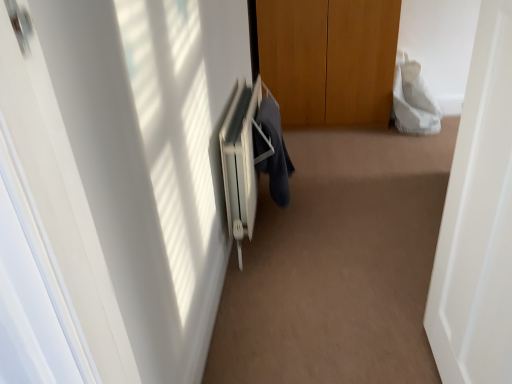
In order to face white textured towel at upper right, which is the 1th robe from back to front, should I rotate leftwards or rightwards?

Turn right approximately 21.077 degrees to face it.

This screenshot has height=384, width=512. What do you see at coordinates (413, 100) in the screenshot? I see `white textured towel at upper right, which is the 1th robe from back to front` at bounding box center [413, 100].

Locate an element on the screen. The image size is (512, 384). white matte door at right is located at coordinates pyautogui.click(x=478, y=220).

Is dark blue fabric at center, the 2th robe in the back-to-front sequence, surrounding white matte door at right?

No, dark blue fabric at center, the 2th robe in the back-to-front sequence, does not contain white matte door at right.

Is dark blue fabric at center, arranged as the 1th robe when viewed from the left, at the left side of white matte door at right?

Correct, you'll find dark blue fabric at center, arranged as the 1th robe when viewed from the left, to the left of white matte door at right.

Can you confirm if dark blue fabric at center, the 2th robe in the back-to-front sequence, is smaller than white matte door at right?

Yes.

Is dark blue fabric at center, which ranks as the 2th robe in top-to-bottom order, in contact with white matte door at right?

No.

Looking at this image, which of these two, dark blue fabric at center, the 2th robe in the back-to-front sequence, or white textured towel at upper right, acting as the second robe starting from the front, is thinner?

dark blue fabric at center, the 2th robe in the back-to-front sequence, is thinner.

From the picture: Considering the relative sizes of dark blue fabric at center, the first robe from the bottom, and white textured towel at upper right, which is the 1th robe from back to front, in the image provided, is dark blue fabric at center, the first robe from the bottom, smaller than white textured towel at upper right, which is the 1th robe from back to front,?

Indeed, dark blue fabric at center, the first robe from the bottom, has a smaller size compared to white textured towel at upper right, which is the 1th robe from back to front.

Can you confirm if dark blue fabric at center, the 2th robe in the back-to-front sequence, is taller than white textured towel at upper right, which is the 1th robe from back to front?

No, dark blue fabric at center, the 2th robe in the back-to-front sequence, is not taller than white textured towel at upper right, which is the 1th robe from back to front.

From the image's perspective, is dark blue fabric at center, which ranks as the 2th robe in top-to-bottom order, positioned above or below white textured towel at upper right, which is the 1th robe from back to front?

Clearly, from the image's perspective, dark blue fabric at center, which ranks as the 2th robe in top-to-bottom order, is below white textured towel at upper right, which is the 1th robe from back to front.

Is white textured towel at upper right, the 1th robe in the top-to-bottom sequence, turned away from white plastic radiator at center?

white textured towel at upper right, the 1th robe in the top-to-bottom sequence, is not turned away from white plastic radiator at center.

Is point (396, 74) farther from viewer compared to point (248, 102)?

That is True.

How different are the orientations of white textured towel at upper right, the second robe ordered from the bottom, and white plastic radiator at center in degrees?

They differ by 92.4 degrees in their facing directions.

From the image's perspective, would you say white textured towel at upper right, the second robe ordered from the bottom, is positioned over white plastic radiator at center?

Yes, from the image's perspective, white textured towel at upper right, the second robe ordered from the bottom, is over white plastic radiator at center.

Relative to dark blue fabric at center, arranged as the 1th robe when viewed from the left, is white textured towel at upper right, positioned as the first robe in right-to-left order, in front or behind?

white textured towel at upper right, positioned as the first robe in right-to-left order, is behind dark blue fabric at center, arranged as the 1th robe when viewed from the left.

Considering the sizes of white textured towel at upper right, the 1th robe in the top-to-bottom sequence, and dark blue fabric at center, the 2th robe in the back-to-front sequence, in the image, is white textured towel at upper right, the 1th robe in the top-to-bottom sequence, bigger or smaller than dark blue fabric at center, the 2th robe in the back-to-front sequence,?

white textured towel at upper right, the 1th robe in the top-to-bottom sequence, is bigger than dark blue fabric at center, the 2th robe in the back-to-front sequence.

From the image's perspective, is white textured towel at upper right, which is the 1th robe from back to front, beneath dark blue fabric at center, the second robe in the right-to-left sequence?

Incorrect, from the image's perspective, white textured towel at upper right, which is the 1th robe from back to front, is higher than dark blue fabric at center, the second robe in the right-to-left sequence.

Is white plastic radiator at center far from white matte door at right?

No, white plastic radiator at center is in close proximity to white matte door at right.

Could you tell me if white plastic radiator at center is facing white matte door at right?

No, white plastic radiator at center is not turned towards white matte door at right.

What's the angular difference between white plastic radiator at center and white matte door at right's facing directions?

white plastic radiator at center and white matte door at right are facing 91 degrees away from each other.

Does point (247, 158) come farther from viewer compared to point (509, 267)?

Yes, point (247, 158) is farther from viewer.

Considering the sizes of objects white matte door at right and white textured towel at upper right, which is the 2th robe from left to right, in the image provided, who is bigger, white matte door at right or white textured towel at upper right, which is the 2th robe from left to right,?

white matte door at right is bigger.

Do you think white matte door at right is within white textured towel at upper right, which is the 1th robe from back to front, or outside of it?

white matte door at right exists outside the volume of white textured towel at upper right, which is the 1th robe from back to front.

Considering the sizes of white matte door at right and white textured towel at upper right, acting as the second robe starting from the front, in the image, is white matte door at right wider or thinner than white textured towel at upper right, acting as the second robe starting from the front,?

Clearly, white matte door at right has more width compared to white textured towel at upper right, acting as the second robe starting from the front.

Can you confirm if white matte door at right is thinner than dark blue fabric at center, the 2th robe in the back-to-front sequence?

No.

How distant is white matte door at right from dark blue fabric at center, arranged as the 1th robe when viewed from the left?

1.03 meters.

Is white matte door at right placed right next to dark blue fabric at center, the 2th robe in the back-to-front sequence?

No.

Relative to dark blue fabric at center, arranged as the 1th robe when viewed from the left, is white matte door at right in front or behind?

Visually, white matte door at right is located in front of dark blue fabric at center, arranged as the 1th robe when viewed from the left.

Where is `door that is above the dark blue fabric at center, the 2th robe in the back-to-front sequence (from a real-world perspective)`? The height and width of the screenshot is (384, 512). door that is above the dark blue fabric at center, the 2th robe in the back-to-front sequence (from a real-world perspective) is located at coordinates (478, 220).

The width and height of the screenshot is (512, 384). What are the coordinates of `robe located on the right of dark blue fabric at center, which is the 1th robe in front-to-back order` in the screenshot? It's located at (413, 100).

Looking at the image, which one is located further to white matte door at right, dark blue fabric at center, arranged as the 1th robe when viewed from the left, or white plastic radiator at center?

dark blue fabric at center, arranged as the 1th robe when viewed from the left.

Consider the image. When comparing their distances from white plastic radiator at center, does white matte door at right or white textured towel at upper right, the 1th robe in the top-to-bottom sequence, seem closer?

white matte door at right is closer to white plastic radiator at center.

From the picture: From the image, which object appears to be farther from dark blue fabric at center, which ranks as the 2th robe in top-to-bottom order, white textured towel at upper right, the 1th robe in the top-to-bottom sequence, or white matte door at right?

white textured towel at upper right, the 1th robe in the top-to-bottom sequence.

Based on their spatial positions, is white plastic radiator at center or white textured towel at upper right, the 1th robe in the top-to-bottom sequence, further from white matte door at right?

Among the two, white textured towel at upper right, the 1th robe in the top-to-bottom sequence, is located further to white matte door at right.

Considering their positions, is white textured towel at upper right, positioned as the first robe in right-to-left order, positioned closer to dark blue fabric at center, the 2th robe in the back-to-front sequence, than white plastic radiator at center?

white plastic radiator at center.

From the image, which object appears to be farther from dark blue fabric at center, which ranks as the 2th robe in top-to-bottom order, white plastic radiator at center or white textured towel at upper right, the 1th robe in the top-to-bottom sequence?

white textured towel at upper right, the 1th robe in the top-to-bottom sequence.

Looking at the image, which one is located further to white plastic radiator at center, dark blue fabric at center, which is the 1th robe in front-to-back order, or white textured towel at upper right, the second robe ordered from the bottom?

white textured towel at upper right, the second robe ordered from the bottom, is positioned further to the anchor white plastic radiator at center.

In the scene shown: Which object lies further to the anchor point white textured towel at upper right, the second robe ordered from the bottom, dark blue fabric at center, the second robe in the right-to-left sequence, or white plastic radiator at center?

white plastic radiator at center is positioned further to the anchor white textured towel at upper right, the second robe ordered from the bottom.

Where is `robe between white plastic radiator at center and white textured towel at upper right, the 1th robe in the top-to-bottom sequence`? robe between white plastic radiator at center and white textured towel at upper right, the 1th robe in the top-to-bottom sequence is located at coordinates (x=272, y=150).

The image size is (512, 384). I want to click on radiator positioned between white matte door at right and white textured towel at upper right, positioned as the first robe in right-to-left order, from near to far, so click(x=240, y=162).

Where is `radiator between white matte door at right and dark blue fabric at center, which is the 1th robe in front-to-back order, along the z-axis`? This screenshot has height=384, width=512. radiator between white matte door at right and dark blue fabric at center, which is the 1th robe in front-to-back order, along the z-axis is located at coordinates (240, 162).

In order to click on robe positioned between white matte door at right and white textured towel at upper right, positioned as the first robe in right-to-left order, from near to far in this screenshot , I will do `click(272, 150)`.